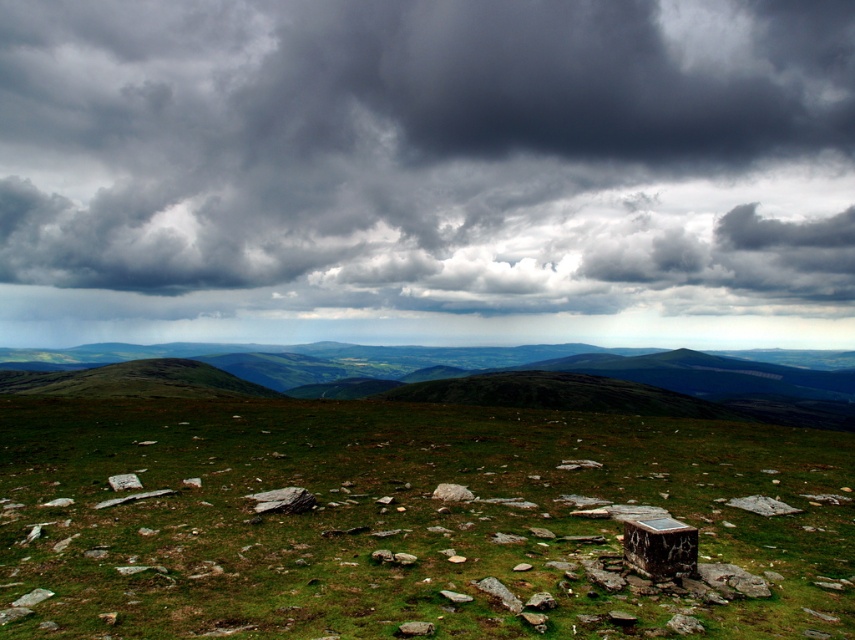
You are standing in the middle of the grassy field and see the gray stone at lower right and the gray rock at lower center. Which one is positioned more to your right side?

The gray stone at lower right is positioned to the right of the gray rock at lower center, so the gray stone at lower right is more to your right side.